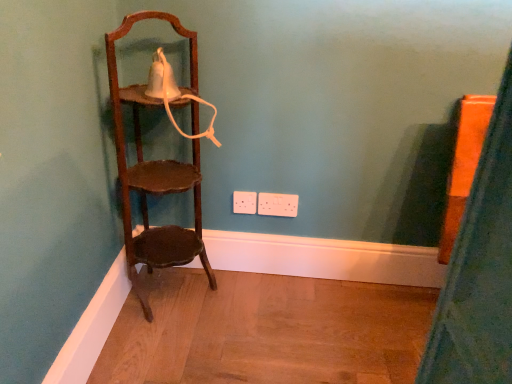
Where is `blank area beneath wooden shelf at left (from a real-world perspective)`? The image size is (512, 384). blank area beneath wooden shelf at left (from a real-world perspective) is located at coordinates (174, 290).